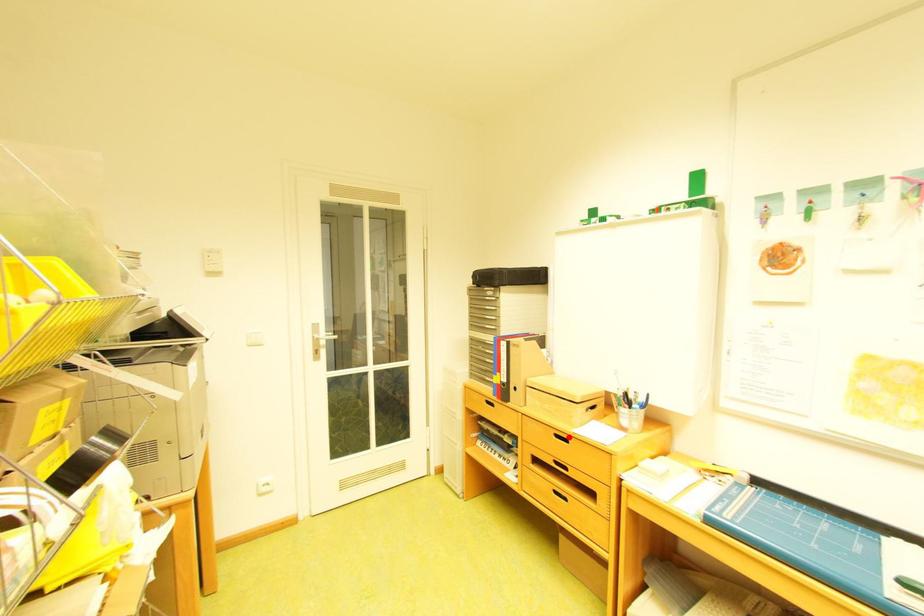
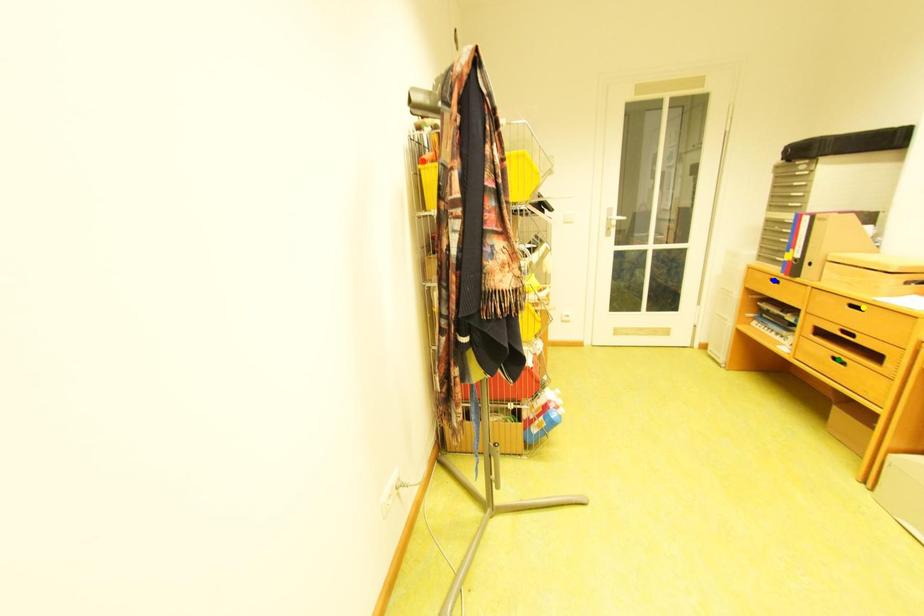
Question: I am providing you with two images of the same scene from different viewpoints. A red point is marked on the first image. You are given multiple points on the second image. Can you choose the point in image 2 that corresponds to the point in image 1?

Choices:
 (A) blue point
 (B) green point
 (C) yellow point

Answer: (C)